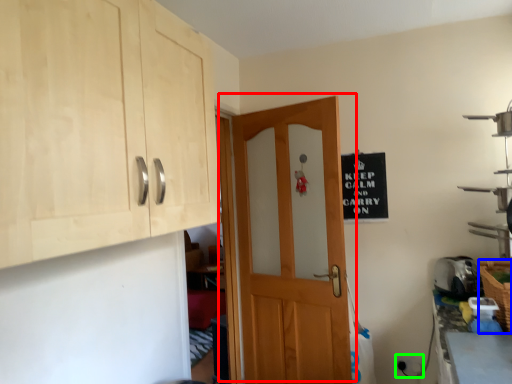
Question: Which object is positioned farthest from door (highlighted by a red box)? Select from basket (highlighted by a blue box) and electric outlet (highlighted by a green box).

Choices:
 (A) basket
 (B) electric outlet

Answer: (A)